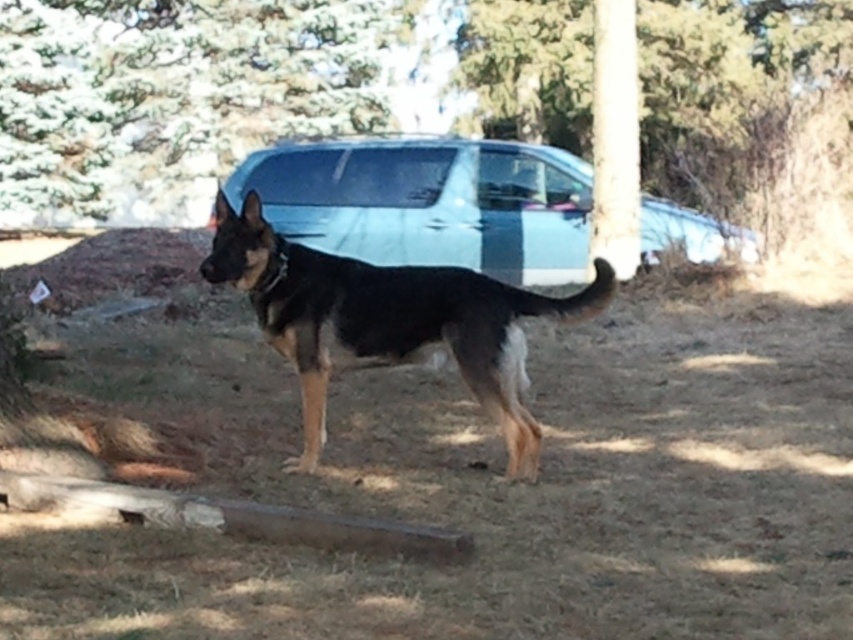
You are standing in the yard and see the smooth bark tree at center and the black glossy dog at center. Which object is located to the right of the other?

The smooth bark tree at center is positioned on the left side of black glossy dog at center, so the black glossy dog at center is to the right of the smooth bark tree at center.

You are planning to take a photo of the black glossy dog at center and the satin silver car at center. Since the car is bigger, where should you position the camera to ensure both subjects are in the frame without cropping either of them?

The satin silver car at center is bigger than the black glossy dog at center, so you should position the camera further away to include both subjects in the frame without cropping either of them.